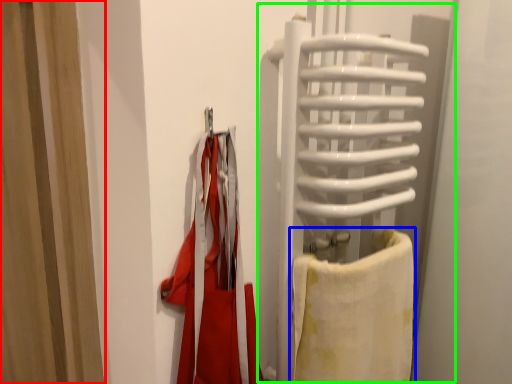
Question: Which is nearer to the curtain (highlighted by a red box)? towel (highlighted by a blue box) or screen door (highlighted by a green box).

Choices:
 (A) towel
 (B) screen door

Answer: (B)